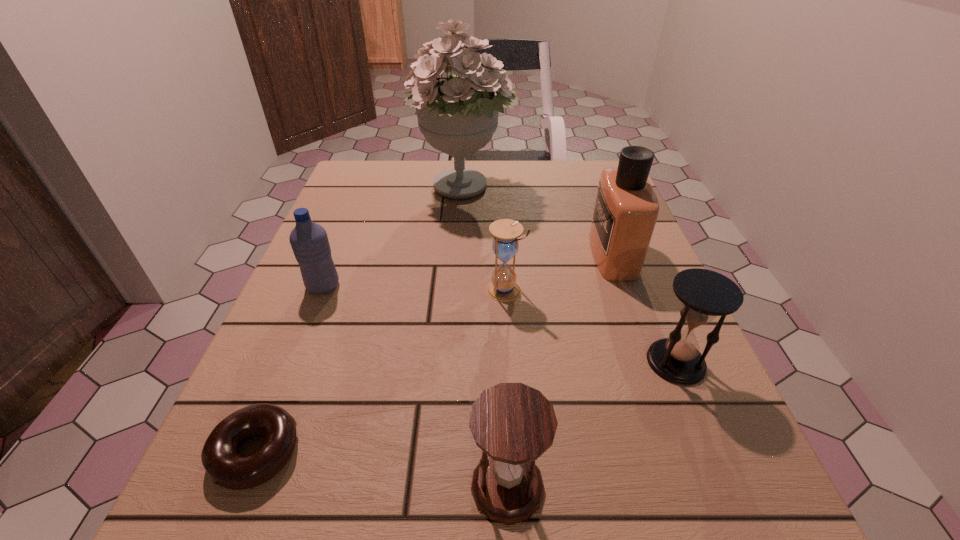
At what (x,y) coordinates should I click in order to perform the action: click on free region located on the front label of the sixth shortest object. Please return your answer as a coordinate pair (x, y). This screenshot has height=540, width=960. Looking at the image, I should click on (541, 255).

Find the location of `free location located on the front label of the sixth shortest object`. free location located on the front label of the sixth shortest object is located at coordinates (509, 255).

Where is `free point located on the front label of the sixth shortest object`? The height and width of the screenshot is (540, 960). free point located on the front label of the sixth shortest object is located at coordinates (434, 255).

The image size is (960, 540). Find the location of `free space located on the back of the water bottle`. free space located on the back of the water bottle is located at coordinates (349, 220).

I want to click on free space located on the front of the farthest hourglass, so [513, 415].

Locate an element on the screen. This screenshot has height=540, width=960. vacant space situated 0.080m on the front of the fifth farthest object is located at coordinates (706, 433).

Locate an element on the screen. free location located on the right of the nearest hourglass is located at coordinates (606, 487).

Where is `vacant space located on the right of the shortest object`? The width and height of the screenshot is (960, 540). vacant space located on the right of the shortest object is located at coordinates (443, 451).

Locate an element on the screen. The image size is (960, 540). object that is at the far edge is located at coordinates (x=458, y=116).

I want to click on hourglass at the near edge, so click(513, 424).